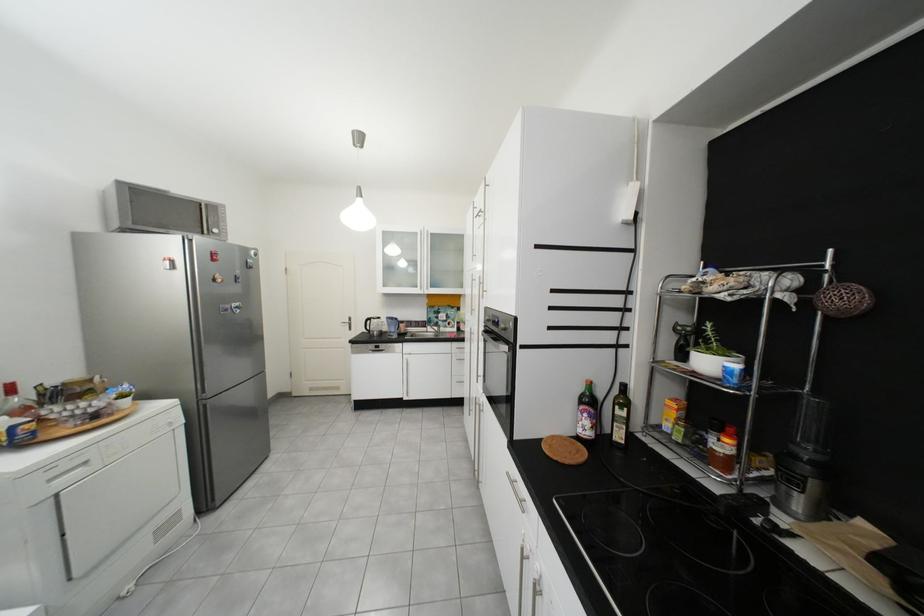
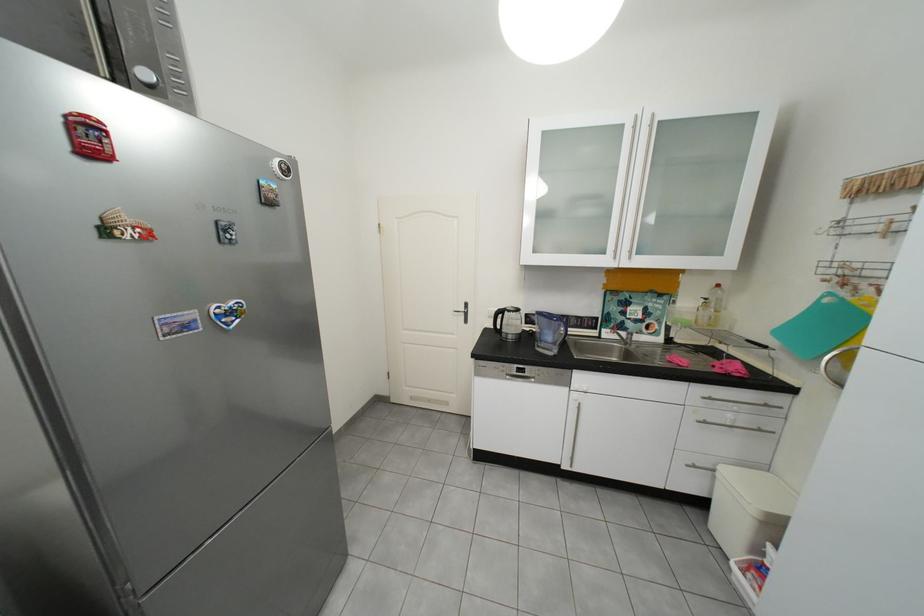
Locate, in the second image, the point that corresponds to point 381,321 in the first image.

(513, 313)